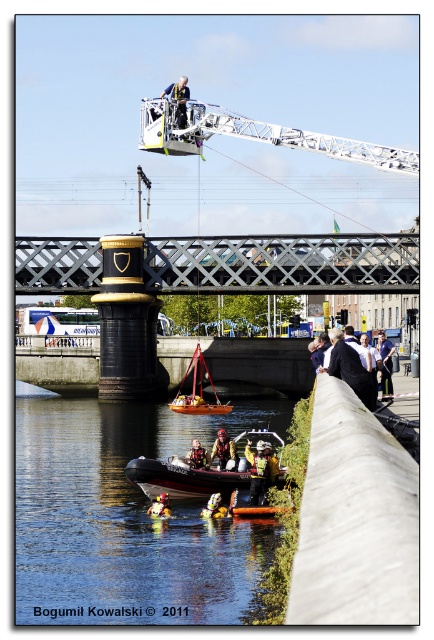
Who is shorter, white metallic crane at upper center or yellow fabric life vest at lower center?

Standing shorter between the two is yellow fabric life vest at lower center.

Is point (371, 157) closer to viewer compared to point (164, 493)?

No.

Where is `white metallic crane at upper center`? This screenshot has height=640, width=434. white metallic crane at upper center is located at coordinates (256, 134).

Is point (400, 156) closer to viewer compared to point (357, 344)?

No.

Measure the distance from white metallic crane at upper center to black suit at center.

They are 39.51 meters apart.

Is point (154, 131) positioned after point (335, 330)?

No, it is in front of (335, 330).

At what (x,y) coordinates should I click in order to perform the action: click on white metallic crane at upper center. Please return your answer as a coordinate pair (x, y). The height and width of the screenshot is (640, 434). Looking at the image, I should click on (256, 134).

What do you see at coordinates (124, 516) in the screenshot?
I see `smooth black water at lower center` at bounding box center [124, 516].

Which is behind, point (29, 545) or point (186, 96)?

Point (186, 96)

Where is `smooth black water at lower center`? The height and width of the screenshot is (640, 434). smooth black water at lower center is located at coordinates (124, 516).